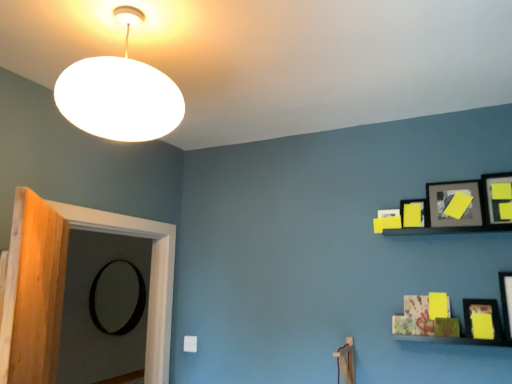
Question: From a real-world perspective, does yellow matte picture frame at upper right, acting as the 4th picture frame starting from the back, sit lower than matte black picture frame at upper right, which is the 4th picture frame in bottom-to-top order?

Choices:
 (A) no
 (B) yes

Answer: (A)

Question: Is yellow matte picture frame at upper right, which is counted as the sixth picture frame, starting from the bottom, not inside matte black picture frame at upper right, the second picture frame from the back?

Choices:
 (A) no
 (B) yes

Answer: (B)

Question: Does yellow matte picture frame at upper right, acting as the 4th picture frame starting from the back, have a lesser width compared to matte black picture frame at upper right, which ranks as the 5th picture frame in right-to-left order?

Choices:
 (A) no
 (B) yes

Answer: (A)

Question: Is yellow matte picture frame at upper right, which ranks as the 3th picture frame in front-to-back order, smaller than matte black picture frame at upper right, placed as the third picture frame when sorted from top to bottom?

Choices:
 (A) yes
 (B) no

Answer: (B)

Question: From a real-world perspective, is yellow matte picture frame at upper right, acting as the 4th picture frame starting from the back, physically above matte black picture frame at upper right, placed as the third picture frame when sorted from top to bottom?

Choices:
 (A) no
 (B) yes

Answer: (B)

Question: Does yellow matte picture frame at upper right, which is the fifth picture frame from left to right, contain matte black picture frame at upper right, which ranks as the 5th picture frame in right-to-left order?

Choices:
 (A) no
 (B) yes

Answer: (A)

Question: Can you confirm if yellow matte picture frame at lower right, the third picture frame when ordered from right to left, is wider than yellow matte picture frame at upper right, which ranks as the 3th picture frame in front-to-back order?

Choices:
 (A) yes
 (B) no

Answer: (A)

Question: Is there a large distance between yellow matte picture frame at lower right, which is the 2th picture frame in front-to-back order, and yellow matte picture frame at upper right, which is counted as the sixth picture frame, starting from the bottom?

Choices:
 (A) yes
 (B) no

Answer: (B)

Question: Is yellow matte picture frame at lower right, which is the fourth picture frame in left-to-right order, aimed at yellow matte picture frame at upper right, acting as the 4th picture frame starting from the back?

Choices:
 (A) no
 (B) yes

Answer: (A)

Question: Does yellow matte picture frame at lower right, the second picture frame when ordered from bottom to top, appear on the right side of yellow matte picture frame at upper right, which is the fifth picture frame from left to right?

Choices:
 (A) yes
 (B) no

Answer: (B)

Question: Can you confirm if yellow matte picture frame at lower right, which is the 2th picture frame in front-to-back order, is positioned to the left of yellow matte picture frame at upper right, the 1th picture frame when ordered from top to bottom?

Choices:
 (A) yes
 (B) no

Answer: (A)

Question: Does yellow matte picture frame at lower right, which is counted as the 5th picture frame, starting from the top, have a lesser height compared to yellow matte picture frame at upper right, which ranks as the 3th picture frame in front-to-back order?

Choices:
 (A) no
 (B) yes

Answer: (B)

Question: Considering the relative positions of matte black picture frame at upper right, which ranks as the 5th picture frame in right-to-left order, and wooden door at left in the image provided, is matte black picture frame at upper right, which ranks as the 5th picture frame in right-to-left order, to the left of wooden door at left from the viewer's perspective?

Choices:
 (A) no
 (B) yes

Answer: (A)